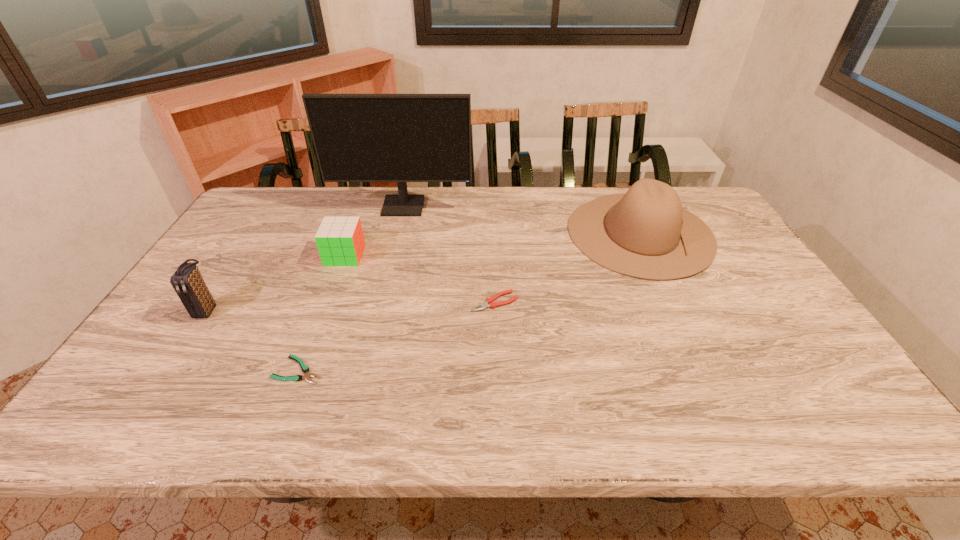
Identify the location of the tallest object. The image size is (960, 540). (401, 138).

The height and width of the screenshot is (540, 960). I want to click on sombrero, so (x=645, y=233).

Identify the location of the fourth shortest object. The image size is (960, 540). (187, 281).

The image size is (960, 540). What are the coordinates of `clutch bag` in the screenshot? It's located at (187, 281).

Find the location of `cube`. cube is located at coordinates (340, 241).

The width and height of the screenshot is (960, 540). I want to click on the right pliers, so click(489, 302).

Where is `the second shortest object`? The height and width of the screenshot is (540, 960). the second shortest object is located at coordinates (489, 302).

Where is `the shorter pliers`? the shorter pliers is located at coordinates (305, 369).

I want to click on the shortest object, so click(x=305, y=369).

You are a GUI agent. You are given a task and a screenshot of the screen. Output one action in this format:
    pyautogui.click(x=<x>, y=<y>)
    Task: Click on the vacant point located 0.080m on the front-facing side of the computer monitor
    
    Given the screenshot: What is the action you would take?
    pyautogui.click(x=397, y=230)